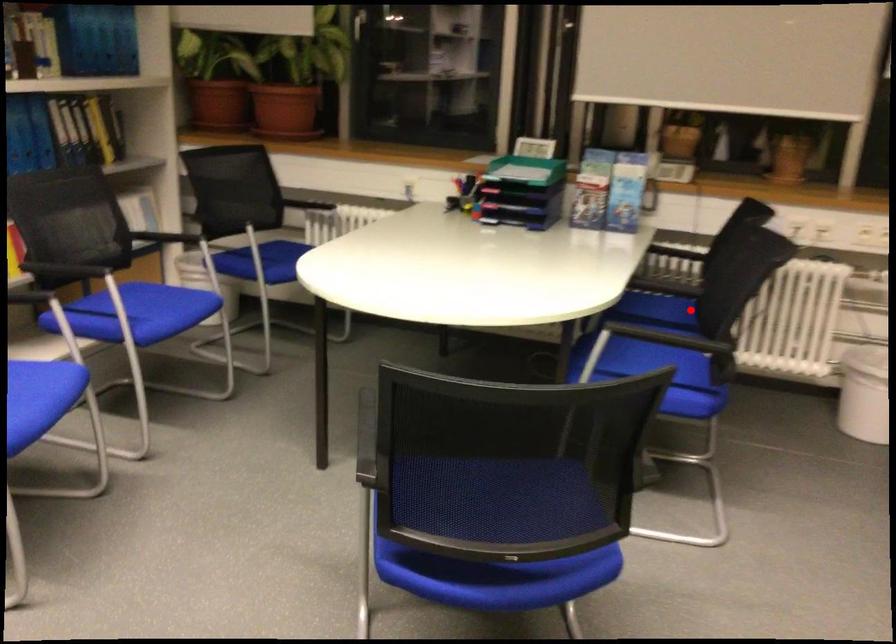
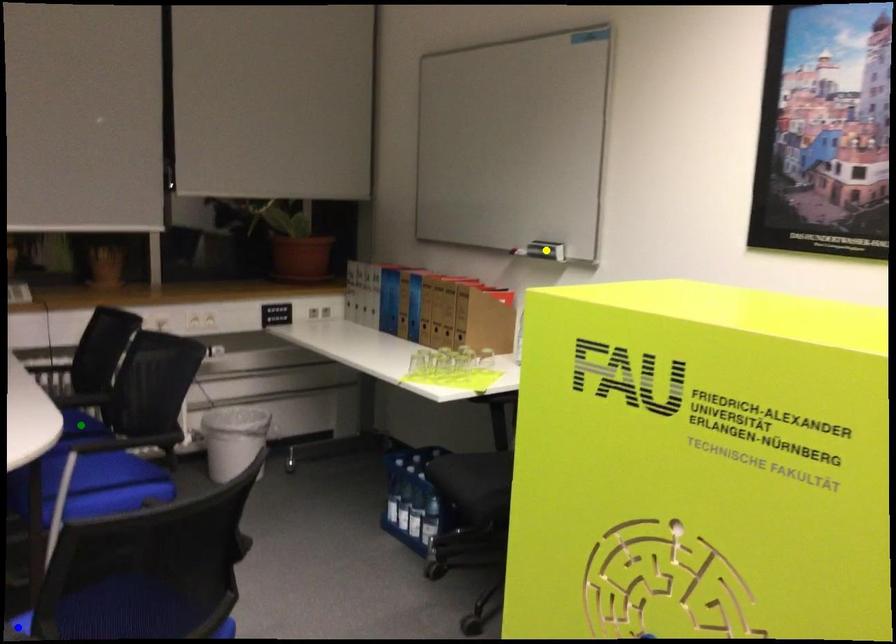
Question: I am providing you with two images of the same scene from different viewpoints. A red point is marked on the first image. You are given multiple points on the second image. In image 2, which mark is for the same physical point as the one in image 1?

Choices:
 (A) yellow point
 (B) green point
 (C) blue point

Answer: (B)